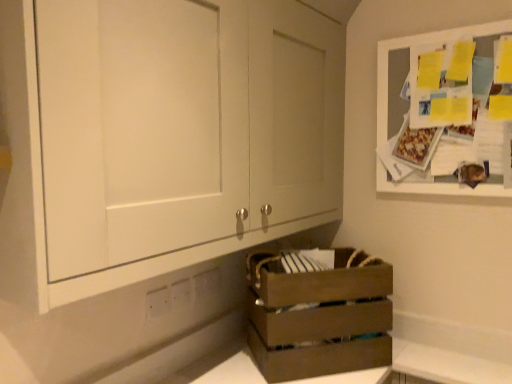
Question: Is brown wooden crate at lower center located within white plastic electric outlet at lower center, placed as the 3th electric outlet when sorted from front to back?

Choices:
 (A) no
 (B) yes

Answer: (A)

Question: Is white plastic electric outlet at lower center, the first electric outlet positioned from the back, thinner than brown wooden crate at lower center?

Choices:
 (A) no
 (B) yes

Answer: (B)

Question: Is white plastic electric outlet at lower center, placed as the 3th electric outlet when sorted from front to back, looking in the opposite direction of brown wooden crate at lower center?

Choices:
 (A) no
 (B) yes

Answer: (A)

Question: From the image's perspective, would you say white plastic electric outlet at lower center, the first electric outlet positioned from the back, is positioned over brown wooden crate at lower center?

Choices:
 (A) no
 (B) yes

Answer: (B)

Question: Is white plastic electric outlet at lower center, placed as the 3th electric outlet when sorted from front to back, positioned behind brown wooden crate at lower center?

Choices:
 (A) no
 (B) yes

Answer: (B)

Question: Is point (292, 286) positioned closer to the camera than point (377, 56)?

Choices:
 (A) farther
 (B) closer

Answer: (B)

Question: Looking at their shapes, would you say brown wooden crate at lower center is wider or thinner than white wood board at upper right, the 2th cabinetry when ordered from left to right?

Choices:
 (A) thin
 (B) wide

Answer: (B)

Question: Is brown wooden crate at lower center inside the boundaries of white wood board at upper right, the 2th cabinetry when ordered from left to right, or outside?

Choices:
 (A) inside
 (B) outside

Answer: (B)

Question: Is brown wooden crate at lower center bigger or smaller than white wood board at upper right, the 2th cabinetry when ordered from left to right?

Choices:
 (A) small
 (B) big

Answer: (B)

Question: From a real-world perspective, relative to white plastic electric outlet at lower center, placed as the 3th electric outlet when sorted from front to back, is white wood board at upper right, the 2th cabinetry when ordered from left to right, vertically above or below?

Choices:
 (A) below
 (B) above

Answer: (B)

Question: Visually, is white wood board at upper right, the 2th cabinetry when ordered from left to right, positioned to the left or to the right of white plastic electric outlet at lower center, which is the 3th electric outlet in left-to-right order?

Choices:
 (A) right
 (B) left

Answer: (A)

Question: Based on their sizes in the image, would you say white wood board at upper right, which is the 1th cabinetry in right-to-left order, is bigger or smaller than white plastic electric outlet at lower center, which is the 3th electric outlet in left-to-right order?

Choices:
 (A) small
 (B) big

Answer: (B)

Question: From their relative heights in the image, would you say white wood board at upper right, which is the 1th cabinetry in right-to-left order, is taller or shorter than white plastic electric outlet at lower center, placed as the 3th electric outlet when sorted from front to back?

Choices:
 (A) tall
 (B) short

Answer: (A)

Question: From a real-world perspective, is white plastic electric outlet at lower center, placed as the 3th electric outlet when sorted from front to back, above or below white plastic electric outlet at lower center, the 1th electric outlet viewed from the left?

Choices:
 (A) above
 (B) below

Answer: (A)

Question: Considering the positions of white plastic electric outlet at lower center, placed as the 3th electric outlet when sorted from front to back, and white plastic electric outlet at lower center, which ranks as the first electric outlet in front-to-back order, in the image, is white plastic electric outlet at lower center, placed as the 3th electric outlet when sorted from front to back, taller or shorter than white plastic electric outlet at lower center, which ranks as the first electric outlet in front-to-back order,?

Choices:
 (A) short
 (B) tall

Answer: (A)